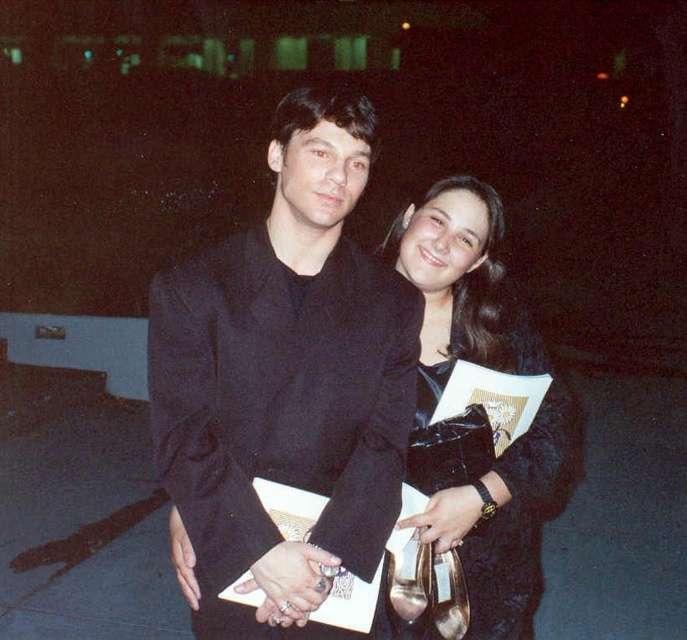
Does black matte suit at center appear on the left side of black satin clutch at center?

Correct, you'll find black matte suit at center to the left of black satin clutch at center.

Is black matte suit at center to the right of black satin clutch at center from the viewer's perspective?

In fact, black matte suit at center is to the left of black satin clutch at center.

Find the location of a particular element. black matte suit at center is located at coordinates (284, 380).

The width and height of the screenshot is (687, 640). I want to click on black matte suit at center, so click(284, 380).